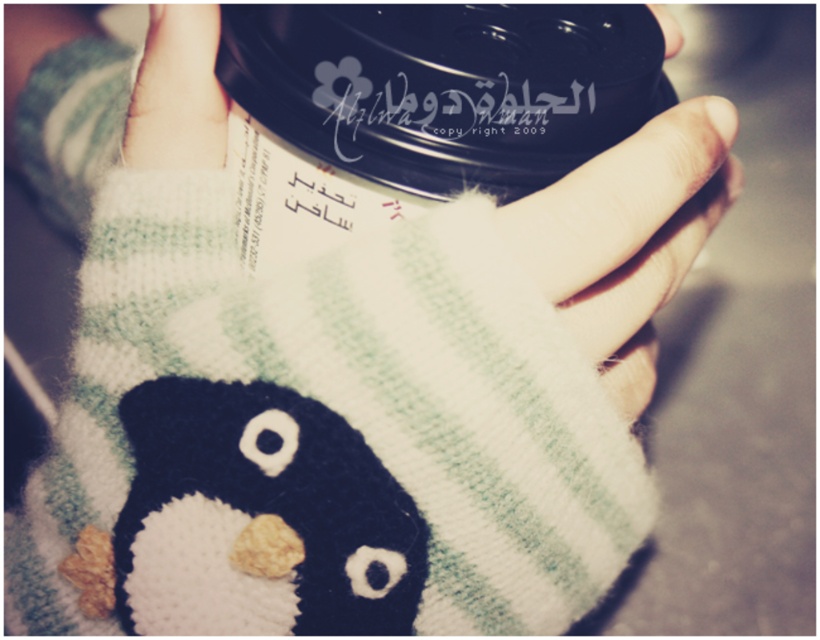
Between white knitted penguin at lower left and white knitted glove at upper left, which one is positioned higher?

white knitted glove at upper left

Consider the image. Is white knitted penguin at lower left thinner than white knitted glove at upper left?

In fact, white knitted penguin at lower left might be wider than white knitted glove at upper left.

Image resolution: width=820 pixels, height=640 pixels. Describe the element at coordinates (258, 516) in the screenshot. I see `white knitted penguin at lower left` at that location.

Locate an element on the screen. Image resolution: width=820 pixels, height=640 pixels. white knitted penguin at lower left is located at coordinates (258, 516).